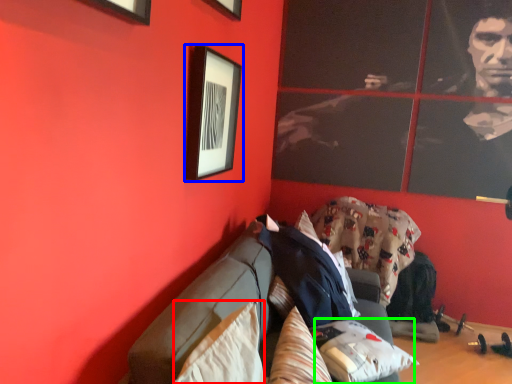
Question: Estimate the real-world distances between objects in this image. Which object is closer to pillow (highlighted by a red box), picture frame (highlighted by a blue box) or pillow (highlighted by a green box)?

Choices:
 (A) picture frame
 (B) pillow

Answer: (B)